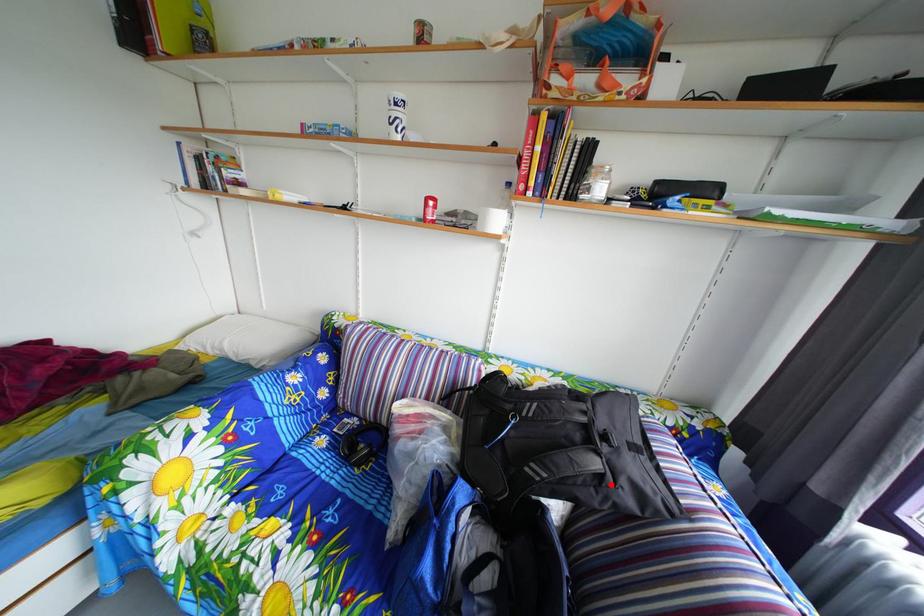
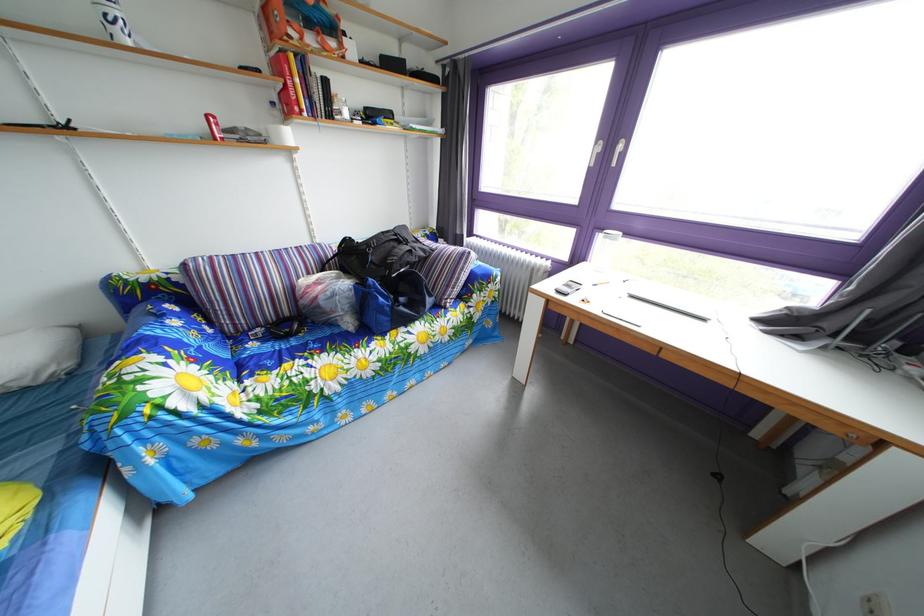
Where in the second image is the point corresponding to the highlighted location from the first image?

(421, 260)